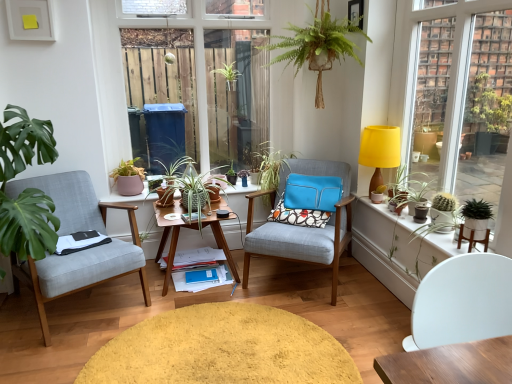
Question: From a real-world perspective, is matte brown flowerpot at center, arranged as the fourth flowerpot when viewed from the front, positioned above or below wooden desk at center?

Choices:
 (A) above
 (B) below

Answer: (A)

Question: Considering the positions of matte brown flowerpot at center, positioned as the 3th flowerpot in right-to-left order, and wooden desk at center in the image, is matte brown flowerpot at center, positioned as the 3th flowerpot in right-to-left order, bigger or smaller than wooden desk at center?

Choices:
 (A) big
 (B) small

Answer: (B)

Question: Which is nearer to the patterned fabric pillow at center?

Choices:
 (A) matte black pot at right, positioned as the 4th flowerpot in left-to-right order
 (B) matte ceramic pot at center, the 1th flowerpot when ordered from left to right
 (C) white matte chair at lower right, the first chair when ordered from front to back
 (D) green leafy plants at upper left
 (E) green glossy plant at center, which is the 2th houseplant from left to right

Answer: (E)

Question: Based on their relative distances, which object is farther from the patterned fabric pillow at center?

Choices:
 (A) green leafy plant at center, the third houseplant from the left
 (B) textured fabric armchair at center, which is the second chair from left to right
 (C) pink ceramic pot at left, the fifth houseplant from the right
 (D) green matte cactus at right
 (E) light gray fabric chair at left, which is the 1th chair from left to right

Answer: (E)